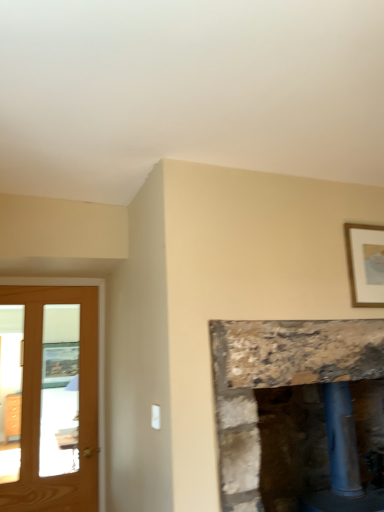
Question: In the image, is rustic stone fireplace at center positioned in front of or behind light brown wooden screen door at left?

Choices:
 (A) behind
 (B) front

Answer: (B)

Question: Is rustic stone fireplace at center taller or shorter than light brown wooden screen door at left?

Choices:
 (A) tall
 (B) short

Answer: (B)

Question: Estimate the real-world distances between objects in this image. Which object is closer to the light brown wooden screen door at left?

Choices:
 (A) rustic stone fireplace at center
 (B) gold wooden picture frame at upper right

Answer: (A)

Question: Which is farther from the light brown wooden screen door at left?

Choices:
 (A) gold wooden picture frame at upper right
 (B) rustic stone fireplace at center

Answer: (A)